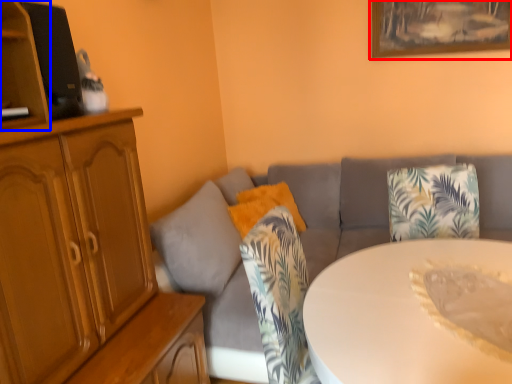
Question: Which object is closer to the camera taking this photo, picture frame (highlighted by a red box) or shelf (highlighted by a blue box)?

Choices:
 (A) picture frame
 (B) shelf

Answer: (B)